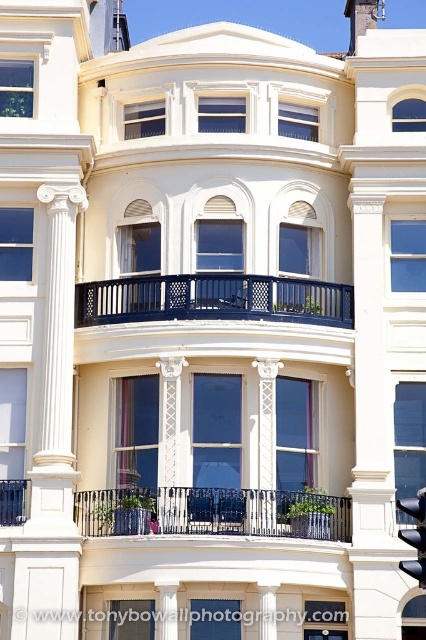
You are standing in front of the building and want to take a photo of both the matte black balcony at center and the black glass traffic light at center. Which object should you position to the right side of your camera frame to include both in the photo?

You should position the black glass traffic light at center to the right side of your camera frame because the matte black balcony at center is to the left of it, so placing the traffic light on the right will ensure both are included in the photo.